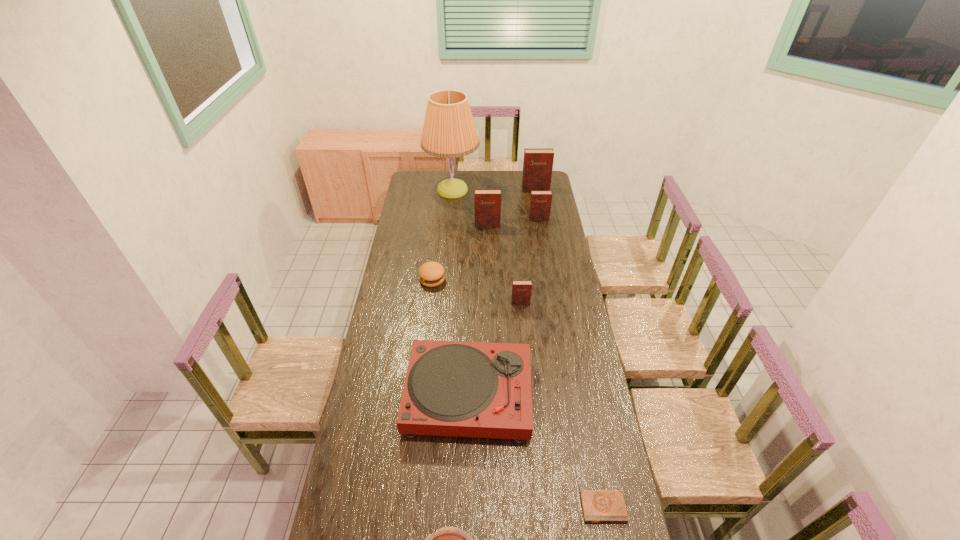
Choose which diary is the third nearest neighbor to the second nearest object. Please provide its 2D coordinates. Your answer should be formatted as a tuple, i.e. [(x, y)], where the tuple contains the x and y coordinates of a point satisfying the conditions above.

[(540, 202)]

The width and height of the screenshot is (960, 540). In order to click on reddish-brown diary that is the nearest to the nearest diary in this screenshot , I will do `click(521, 289)`.

Locate an element on the screen. reddish-brown diary that is the third nearest to the sixth shortest object is located at coordinates (521, 289).

Find the location of a particular element. The height and width of the screenshot is (540, 960). blank space that satisfies the following two spatial constraints: 1. on the side of the lamp near the pull switch; 2. on the right side of the red record player is located at coordinates (435, 395).

Locate an element on the screen. This screenshot has width=960, height=540. free spot that satisfies the following two spatial constraints: 1. on the side of the red record player near the pull switch; 2. on the right side of the beige lamp is located at coordinates tap(435, 395).